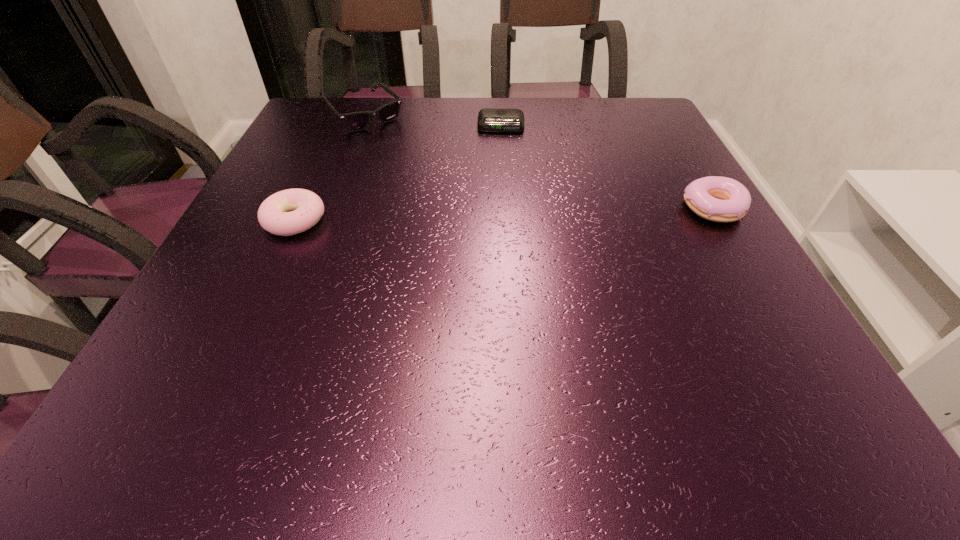
The width and height of the screenshot is (960, 540). Identify the location of free spot on the desktop that is between the left doughnut and the right doughnut and is positioned on the display of the alarm clock. (499, 214).

Locate an element on the screen. The width and height of the screenshot is (960, 540). free space on the desktop that is between the left doughnut and the right doughnut and is positioned on the front-facing side of the sunglasses is located at coordinates (469, 215).